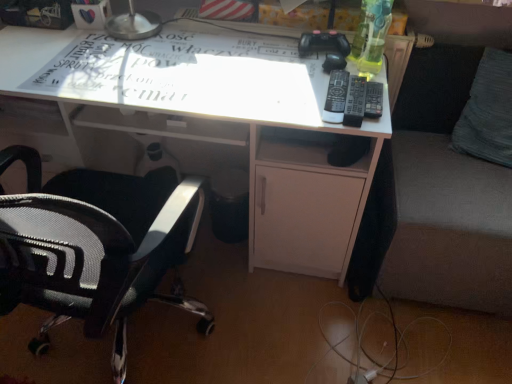
Identify the location of blank space to the left of black plastic remote at right, the 2th remote viewed from the left. This screenshot has width=512, height=384. (292, 96).